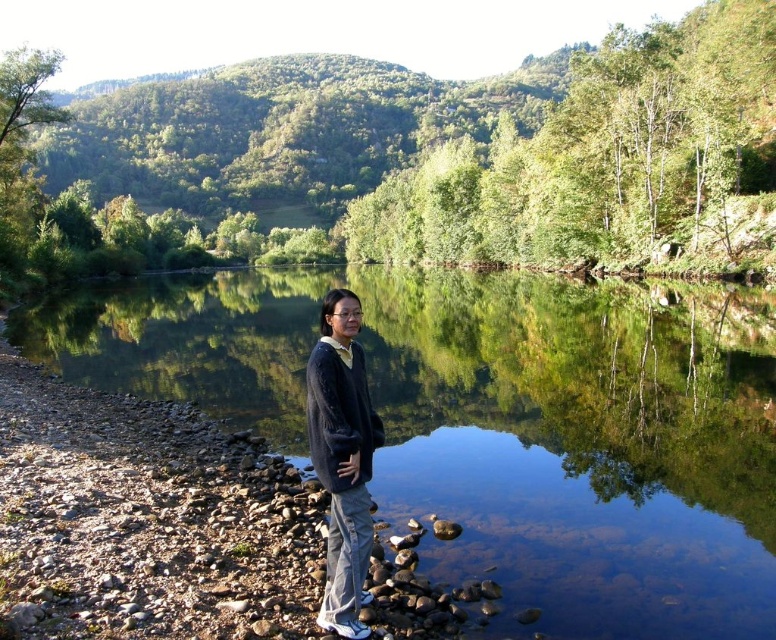
Question: Which point is farther from the camera taking this photo?

Choices:
 (A) coord(695,612)
 (B) coord(343,460)

Answer: (B)

Question: Does clear glass water at center lie in front of dark blue sweater at center?

Choices:
 (A) no
 (B) yes

Answer: (A)

Question: Does clear glass water at center lie in front of dark blue sweater at center?

Choices:
 (A) no
 (B) yes

Answer: (A)

Question: Does clear glass water at center have a greater width compared to dark blue sweater at center?

Choices:
 (A) yes
 (B) no

Answer: (A)

Question: Which of the following is the farthest from the observer?

Choices:
 (A) (324, 342)
 (B) (127, 298)

Answer: (B)